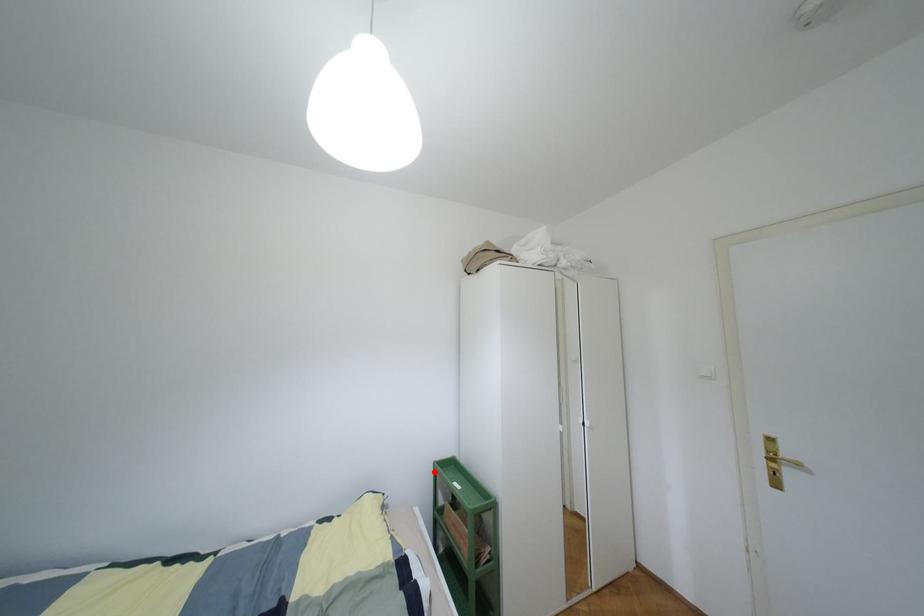
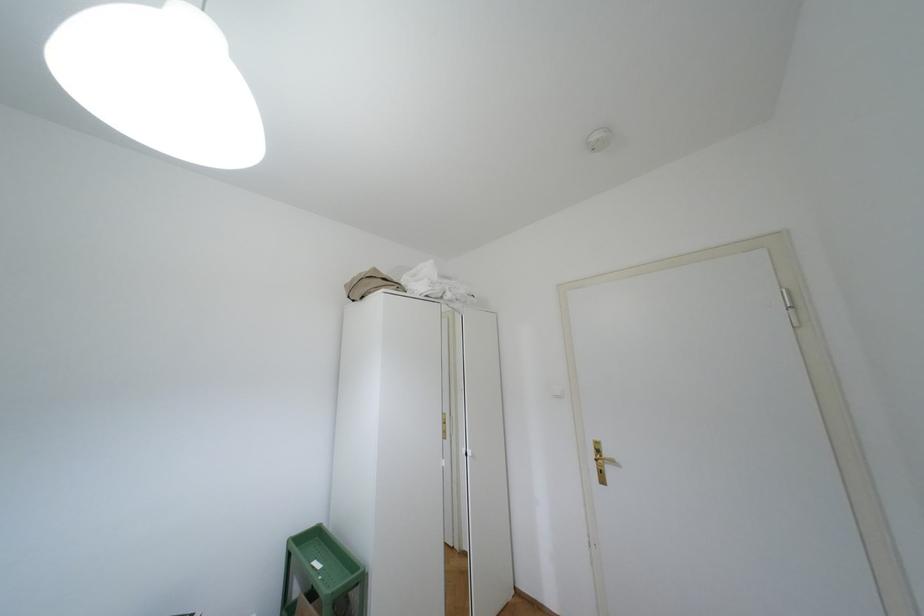
Question: A red point is marked in image1. In image2, is the corresponding 3D point closer to the camera or farther? Reply with the corresponding letter.

Choices:
 (A) The corresponding 3D point is closer.
 (B) The corresponding 3D point is farther.

Answer: (A)